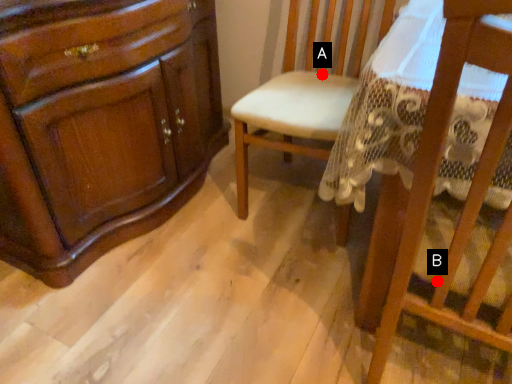
Question: Two points are circled on the image, labeled by A and B beside each circle. Which point is closer to the camera taking this photo?

Choices:
 (A) A is closer
 (B) B is closer

Answer: (B)